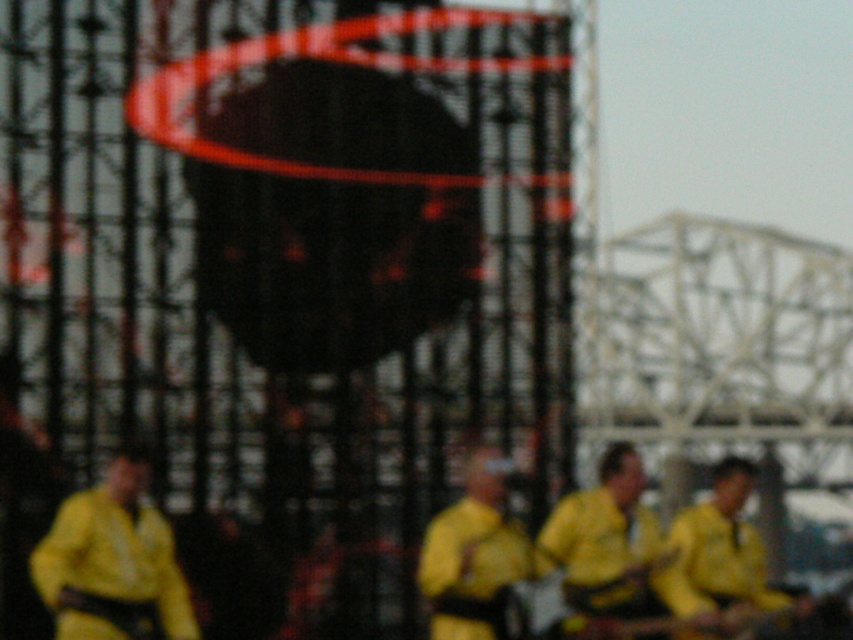
You are a photographer at the event. You want to take a photo of the yellow matte guitar at center and the yellow matte shirt at center. Which object should you zoom in on to capture more details of the object itself without cropping the other object out?

The yellow matte guitar at center is wider than the yellow matte shirt at center, so you should zoom in on the yellow matte shirt at center to capture its details without cropping the guitar out.

You are a photographer at the event and want to capture a clear image of the yellow matte guitar at center and the yellow matte uniform at center. Since the scene is blurry, you decide to adjust your camera settings. Considering the objects in the foreground, which object should you focus on first to ensure both are in focus?

The yellow matte guitar at center is thinner than the yellow matte uniform at center, so focusing on the thinner object first would help ensure both are in focus.

You are a photographer at the event and want to capture a photo where the yellow matte guitar at center and the yellow matte uniform at center are both visible. Based on their positions, which object should you position on the left side of your camera frame?

The yellow matte guitar at center is to the left of the yellow matte uniform at center, so you should position the yellow matte guitar at center on the left side of your camera frame.